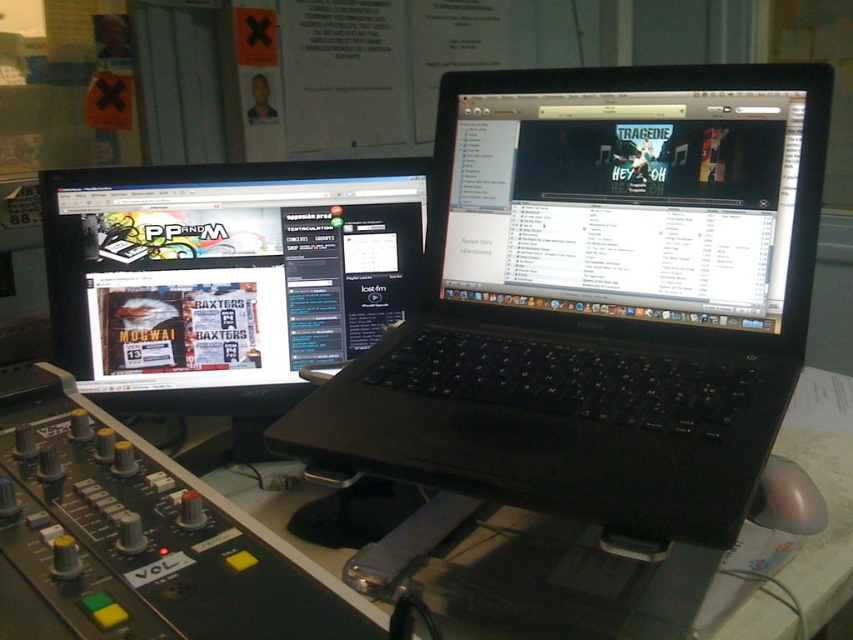
Question: Which is farther from the matte black monitor at left?

Choices:
 (A) black matte laptop at upper center
 (B) black glossy laptop at upper center

Answer: (A)

Question: Is black matte laptop at upper center further to camera compared to black glossy laptop at upper center?

Choices:
 (A) no
 (B) yes

Answer: (A)

Question: Can you confirm if matte black monitor at left is positioned to the left of black glossy laptop at upper center?

Choices:
 (A) yes
 (B) no

Answer: (A)

Question: Which is farther from the black matte laptop at upper center?

Choices:
 (A) black glossy laptop at upper center
 (B) matte black monitor at left

Answer: (B)

Question: Observing the image, what is the correct spatial positioning of matte black monitor at left in reference to black glossy laptop at upper center?

Choices:
 (A) left
 (B) right

Answer: (A)

Question: Which of the following is the farthest from the observer?

Choices:
 (A) black matte laptop at upper center
 (B) matte black monitor at left
 (C) black glossy laptop at upper center

Answer: (B)